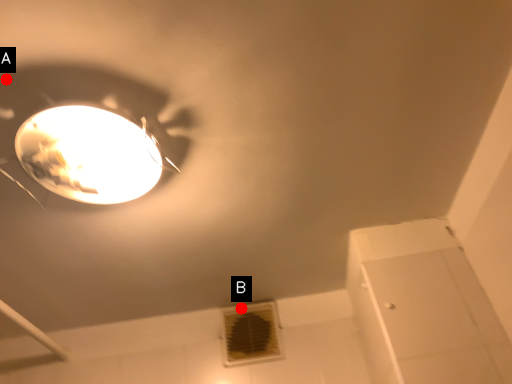
Question: Two points are circled on the image, labeled by A and B beside each circle. Which point appears closest to the camera in this image?

Choices:
 (A) A is closer
 (B) B is closer

Answer: (A)